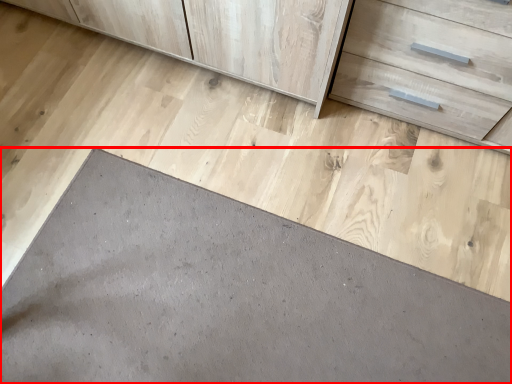
Question: From the image's perspective, where is slate (annotated by the red box) located relative to drawer?

Choices:
 (A) below
 (B) above

Answer: (A)